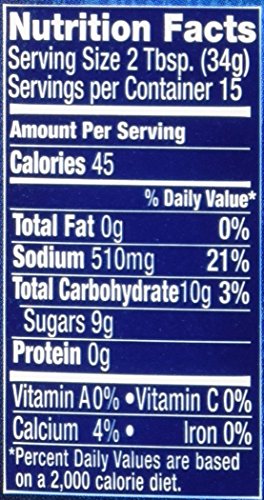
In order to click on iron in this screenshot , I will do `click(191, 438)`.